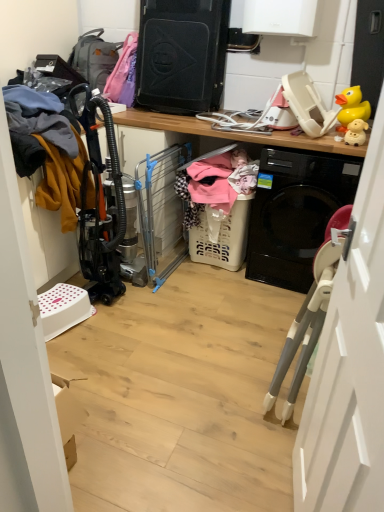
Question: Does soft pink fabric at center, the 1th clothing viewed from the right, appear on the right side of matte gray backpack at upper left?

Choices:
 (A) yes
 (B) no

Answer: (A)

Question: Is soft pink fabric at center, the 1th clothing viewed from the right, placed right next to matte gray backpack at upper left?

Choices:
 (A) no
 (B) yes

Answer: (A)

Question: Is soft pink fabric at center, which appears as the 2th clothing when viewed from the left, wider than matte gray backpack at upper left?

Choices:
 (A) no
 (B) yes

Answer: (B)

Question: Considering the relative sizes of soft pink fabric at center, the 1th clothing viewed from the right, and matte gray backpack at upper left in the image provided, is soft pink fabric at center, the 1th clothing viewed from the right, shorter than matte gray backpack at upper left?

Choices:
 (A) yes
 (B) no

Answer: (B)

Question: Does soft pink fabric at center, which appears as the 2th clothing when viewed from the left, have a larger size compared to matte gray backpack at upper left?

Choices:
 (A) yes
 (B) no

Answer: (A)

Question: In terms of size, does white plastic laundry basket at center appear bigger or smaller than matte gray backpack at upper left?

Choices:
 (A) small
 (B) big

Answer: (B)

Question: Considering the positions of point (258, 137) and point (89, 37), is point (258, 137) closer or farther from the camera than point (89, 37)?

Choices:
 (A) farther
 (B) closer

Answer: (B)

Question: From a real-world perspective, is white plastic laundry basket at center above or below matte gray backpack at upper left?

Choices:
 (A) above
 (B) below

Answer: (B)

Question: From their relative heights in the image, would you say white plastic laundry basket at center is taller or shorter than matte gray backpack at upper left?

Choices:
 (A) tall
 (B) short

Answer: (A)

Question: Does point (218, 243) appear closer or farther from the camera than point (135, 124)?

Choices:
 (A) closer
 (B) farther

Answer: (B)

Question: Is white plastic laundry basket at center to the left or to the right of white plastic laundry basket at center in the image?

Choices:
 (A) left
 (B) right

Answer: (A)

Question: Is white plastic laundry basket at center inside or outside of white plastic laundry basket at center?

Choices:
 (A) outside
 (B) inside

Answer: (B)

Question: Looking at the image, does white plastic laundry basket at center seem bigger or smaller compared to white plastic laundry basket at center?

Choices:
 (A) big
 (B) small

Answer: (B)

Question: From a real-world perspective, is yellow rubber duck at upper right, the 2th toy viewed from the front, physically located above or below yellow rubber toy at upper right, the 1th toy when ordered from bottom to top?

Choices:
 (A) below
 (B) above

Answer: (B)

Question: Looking at the image, does yellow rubber duck at upper right, the first toy when ordered from top to bottom, seem bigger or smaller compared to yellow rubber toy at upper right, the 2th toy when ordered from back to front?

Choices:
 (A) small
 (B) big

Answer: (B)